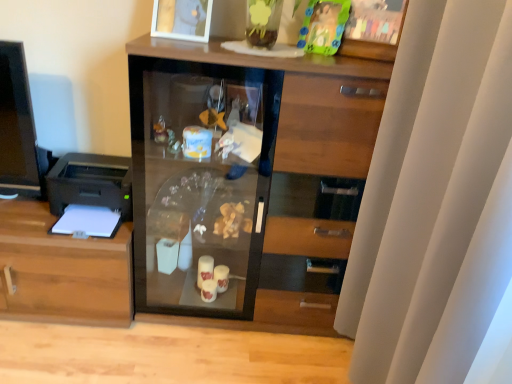
You are a GUI agent. You are given a task and a screenshot of the screen. Output one action in this format:
    pyautogui.click(x=<x>, y=<y>)
    Task: Click on the free location in front of translucent plastic toy at upper center
    The width and height of the screenshot is (512, 384).
    Given the screenshot: What is the action you would take?
    pyautogui.click(x=315, y=57)